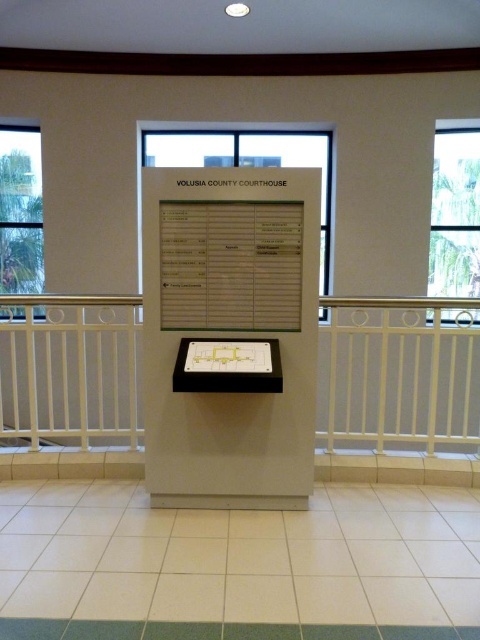
You are standing in the Volusia County Courthouse and need to determine if a 3.5 meter long banner can be hung between the clear glass window at upper right and the clear glass window at upper left. Based on the available information, will the banner fit? Please provide a concise answer.

The distance between the clear glass window at upper right and the clear glass window at upper left is 4.34 meters. Since the banner is 3.5 meters long, it will fit comfortably between them.

You are standing in front of the information kiosk at the Volusia County Courthouse. You notice two points marked on the floor near the kiosk. The first point is at coordinate [294,326] and the second is at [36,244]. If you want to walk towards the point that is closer to you, which coordinate should you head towards?

Point [294,326] is closer to the viewer than point [36,244], so you should head towards point [294,326].